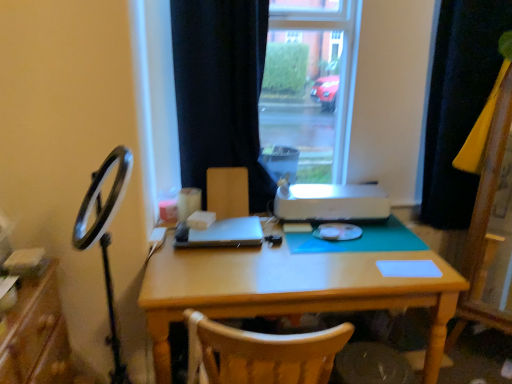
Image resolution: width=512 pixels, height=384 pixels. What do you see at coordinates (220, 90) in the screenshot?
I see `black fabric curtain at center, which is the first curtain from left to right` at bounding box center [220, 90].

What are the coordinates of `white matte notepad at center` in the screenshot? It's located at (408, 268).

What do you see at coordinates (228, 192) in the screenshot? I see `wooden chair at center` at bounding box center [228, 192].

Where is `black fabric curtain at right, arranged as the first curtain when viewed from the right`? The image size is (512, 384). black fabric curtain at right, arranged as the first curtain when viewed from the right is located at coordinates (458, 103).

In the scene shown: What is the approximate height of black fabric curtain at right, arranged as the second curtain when viewed from the left?

The height of black fabric curtain at right, arranged as the second curtain when viewed from the left, is 3.69 feet.

What are the coordinates of `white plastic printer at center` in the screenshot? It's located at (330, 202).

From the image's perspective, which is below, white plastic printer at center or wooden chair at center?

white plastic printer at center.

Would you say white plastic printer at center is inside or outside wooden chair at center?

white plastic printer at center lies outside wooden chair at center.

Who is shorter, white plastic printer at center or wooden chair at center?

white plastic printer at center is shorter.

How much distance is there between white plastic printer at center and wooden chair at center?

white plastic printer at center is 13.06 inches away from wooden chair at center.

Is black fabric curtain at center, which is the 2th curtain in right-to-left order, in front of or behind black fabric curtain at right, arranged as the second curtain when viewed from the left, in the image?

black fabric curtain at center, which is the 2th curtain in right-to-left order, is in front of black fabric curtain at right, arranged as the second curtain when viewed from the left.

Is black fabric curtain at right, arranged as the first curtain when viewed from the right, at the back of black fabric curtain at center, which is the 2th curtain in right-to-left order?

That's not correct — black fabric curtain at center, which is the 2th curtain in right-to-left order, is not looking away from black fabric curtain at right, arranged as the first curtain when viewed from the right.

Does black fabric curtain at center, which is the first curtain from left to right, have a lesser height compared to black fabric curtain at right, arranged as the second curtain when viewed from the left?

Correct, black fabric curtain at center, which is the first curtain from left to right, is not as tall as black fabric curtain at right, arranged as the second curtain when viewed from the left.

How distant is black fabric curtain at center, which is the first curtain from left to right, from black fabric curtain at right, arranged as the second curtain when viewed from the left?

A distance of 38.44 inches exists between black fabric curtain at center, which is the first curtain from left to right, and black fabric curtain at right, arranged as the second curtain when viewed from the left.

From their relative heights in the image, would you say black fabric curtain at right, arranged as the first curtain when viewed from the right, is taller or shorter than white matte notepad at center?

Clearly, black fabric curtain at right, arranged as the first curtain when viewed from the right, is taller compared to white matte notepad at center.

How different are the orientations of black fabric curtain at right, arranged as the second curtain when viewed from the left, and white matte notepad at center in degrees?

There is a 168-degree angle between the facing directions of black fabric curtain at right, arranged as the second curtain when viewed from the left, and white matte notepad at center.

In the scene shown: Considering the relative sizes of black fabric curtain at right, arranged as the second curtain when viewed from the left, and white matte notepad at center in the image provided, is black fabric curtain at right, arranged as the second curtain when viewed from the left, thinner than white matte notepad at center?

Incorrect, the width of black fabric curtain at right, arranged as the second curtain when viewed from the left, is not less than that of white matte notepad at center.

From a real-world perspective, is black fabric curtain at right, arranged as the second curtain when viewed from the left, on top of white matte notepad at center?

Yes, from a real-world perspective, black fabric curtain at right, arranged as the second curtain when viewed from the left, is on top of white matte notepad at center.

Who is more distant, black fabric curtain at right, arranged as the first curtain when viewed from the right, or wooden chair at center?

Positioned behind is wooden chair at center.

Considering the sizes of objects black fabric curtain at right, arranged as the second curtain when viewed from the left, and wooden chair at center in the image provided, who is smaller, black fabric curtain at right, arranged as the second curtain when viewed from the left, or wooden chair at center?

wooden chair at center.

From the picture: Which of these two, black fabric curtain at right, arranged as the first curtain when viewed from the right, or wooden chair at center, is wider?

black fabric curtain at right, arranged as the first curtain when viewed from the right.

Between white matte notepad at center and satin black laptop at center, which one has more height?

satin black laptop at center.

Would you say white matte notepad at center contains satin black laptop at center?

No, satin black laptop at center is not surrounded by white matte notepad at center.

Could you tell me if white matte notepad at center is facing satin black laptop at center?

No, white matte notepad at center is not aimed at satin black laptop at center.

Does white matte notepad at center have a larger size compared to satin black laptop at center?

No.

From the image's perspective, between satin black laptop at center and black fabric curtain at center, which is the 2th curtain in right-to-left order, who is located below?

satin black laptop at center is shown below in the image.

Can you confirm if satin black laptop at center is thinner than black fabric curtain at center, which is the 2th curtain in right-to-left order?

Yes.

Where is `curtain that is the 2nd one when counting upward from the satin black laptop at center (from the image's perspective)`? curtain that is the 2nd one when counting upward from the satin black laptop at center (from the image's perspective) is located at coordinates (220, 90).

Consider the image. Considering the relative positions of satin black laptop at center and black fabric curtain at center, which is the first curtain from left to right, in the image provided, is satin black laptop at center to the right of black fabric curtain at center, which is the first curtain from left to right, from the viewer's perspective?

No.

Is there a large distance between satin black laptop at center and black fabric curtain at right, arranged as the second curtain when viewed from the left?

Yes, satin black laptop at center is far from black fabric curtain at right, arranged as the second curtain when viewed from the left.

Is satin black laptop at center in front of or behind black fabric curtain at right, arranged as the first curtain when viewed from the right, in the image?

Clearly, satin black laptop at center is in front of black fabric curtain at right, arranged as the first curtain when viewed from the right.

From the image's perspective, is satin black laptop at center above or below black fabric curtain at right, arranged as the second curtain when viewed from the left?

Clearly, from the image's perspective, satin black laptop at center is below black fabric curtain at right, arranged as the second curtain when viewed from the left.

Is black fabric curtain at right, arranged as the second curtain when viewed from the left, a part of satin black laptop at center?

No, satin black laptop at center does not contain black fabric curtain at right, arranged as the second curtain when viewed from the left.

This screenshot has width=512, height=384. In order to click on armchair located above the white plastic printer at center (from a real-world perspective) in this screenshot , I will do (228, 192).

The height and width of the screenshot is (384, 512). I want to click on curtain below the black fabric curtain at center, which is the first curtain from left to right (from a real-world perspective), so click(x=458, y=103).

Considering their positions, is white matte notepad at center positioned closer to black fabric curtain at center, which is the first curtain from left to right, than black fabric curtain at right, arranged as the first curtain when viewed from the right?

white matte notepad at center is positioned closer to the anchor black fabric curtain at center, which is the first curtain from left to right.

When comparing their distances from black fabric curtain at right, arranged as the first curtain when viewed from the right, does wooden desk at center or wooden chair at center seem further?

wooden chair at center.

Considering their positions, is white matte notepad at center positioned further to wooden chair at center than satin black laptop at center?

white matte notepad at center lies further to wooden chair at center than the other object.

Which object lies nearer to the anchor point wooden desk at center, satin black laptop at center or white plastic printer at center?

satin black laptop at center is positioned closer to the anchor wooden desk at center.

Which object lies further to the anchor point black fabric curtain at center, which is the 2th curtain in right-to-left order, satin black laptop at center or wooden chair at center?

satin black laptop at center is further to black fabric curtain at center, which is the 2th curtain in right-to-left order.

Looking at the image, which one is located closer to satin black laptop at center, black fabric curtain at center, which is the first curtain from left to right, or wooden desk at center?

wooden desk at center is closer to satin black laptop at center.

When comparing their distances from wooden desk at center, does black fabric curtain at right, arranged as the first curtain when viewed from the right, or wooden chair at center seem closer?

The object closer to wooden desk at center is wooden chair at center.

Considering their positions, is white plastic printer at center positioned further to black fabric curtain at center, which is the 2th curtain in right-to-left order, than black fabric curtain at right, arranged as the second curtain when viewed from the left?

Based on the image, black fabric curtain at right, arranged as the second curtain when viewed from the left, appears to be further to black fabric curtain at center, which is the 2th curtain in right-to-left order.

Locate an element on the screen. printer between wooden desk at center and black fabric curtain at right, arranged as the first curtain when viewed from the right is located at coordinates coord(330,202).

The height and width of the screenshot is (384, 512). I want to click on notepad situated between satin black laptop at center and black fabric curtain at right, arranged as the first curtain when viewed from the right, from left to right, so click(408, 268).

At what (x,y) coordinates should I click in order to perform the action: click on armchair between satin black laptop at center and white plastic printer at center. Please return your answer as a coordinate pair (x, y). This screenshot has height=384, width=512. Looking at the image, I should click on (228, 192).

Find the location of `laptop between wooden chair at center and wooden desk at center in the vertical direction`. laptop between wooden chair at center and wooden desk at center in the vertical direction is located at coordinates (223, 234).